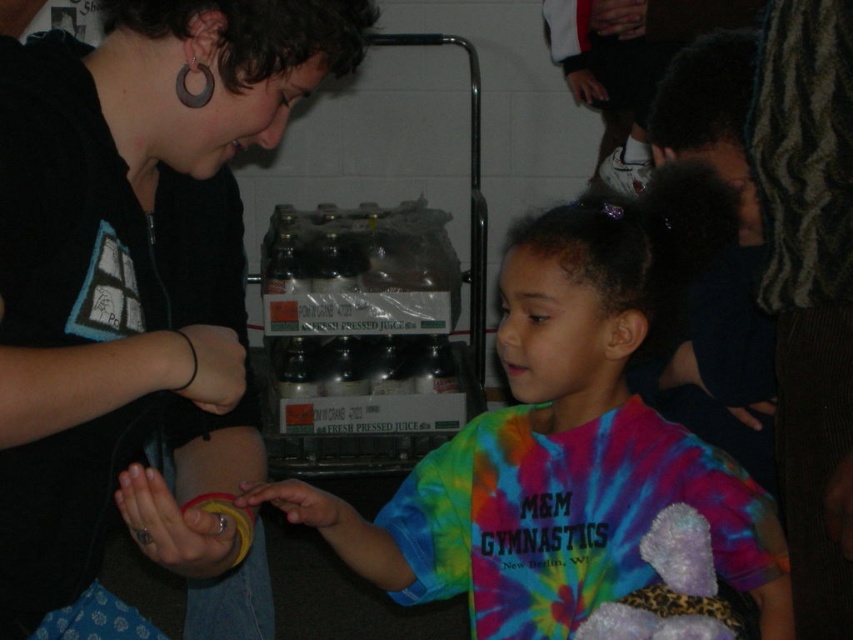
Question: Which object appears closest to the camera in this image?

Choices:
 (A) tie-dye fabric shirt at center
 (B) black matte shirt at center

Answer: (B)

Question: Observing the image, what is the correct spatial positioning of tie-dye fabric shirt at center in reference to matte gold ring at lower left?

Choices:
 (A) right
 (B) left

Answer: (A)

Question: Is matte gold ring at lower left closer to the viewer compared to smooth yellow ring at center?

Choices:
 (A) yes
 (B) no

Answer: (A)

Question: Which of these objects is positioned closest to the smooth yellow ring at center?

Choices:
 (A) matte gold ring at lower left
 (B) tie-dye fabric shirt at center
 (C) black matte shirt at center

Answer: (A)

Question: Does black rubber bracelet at lower left lie behind smooth yellow ring at center?

Choices:
 (A) no
 (B) yes

Answer: (A)

Question: Estimate the real-world distances between objects in this image. Which object is farther from the matte gold ring at lower left?

Choices:
 (A) black matte shirt at center
 (B) tie-dye fabric shirt at center
 (C) black rubber bracelet at lower left
 (D) smooth yellow ring at center

Answer: (B)